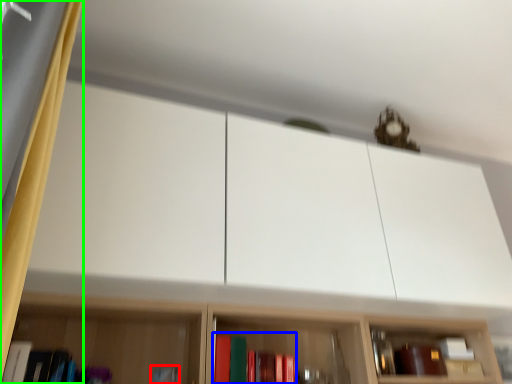
Question: Based on their relative distances, which object is nearer to book (highlighted by a red box)? Choose from book (highlighted by a blue box) and curtain (highlighted by a green box).

Choices:
 (A) book
 (B) curtain

Answer: (A)